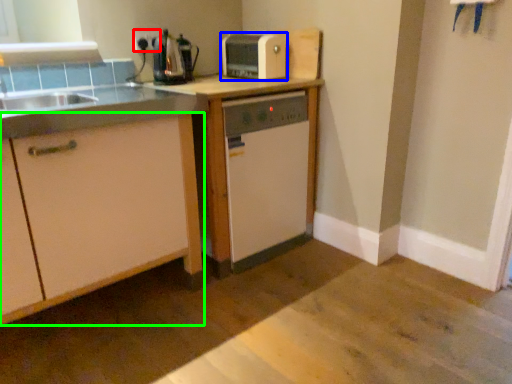
Question: Estimate the real-world distances between objects in this image. Which object is closer to electric outlet (highlighted by a red box), kitchen appliance (highlighted by a blue box) or cabinetry (highlighted by a green box)?

Choices:
 (A) kitchen appliance
 (B) cabinetry

Answer: (A)